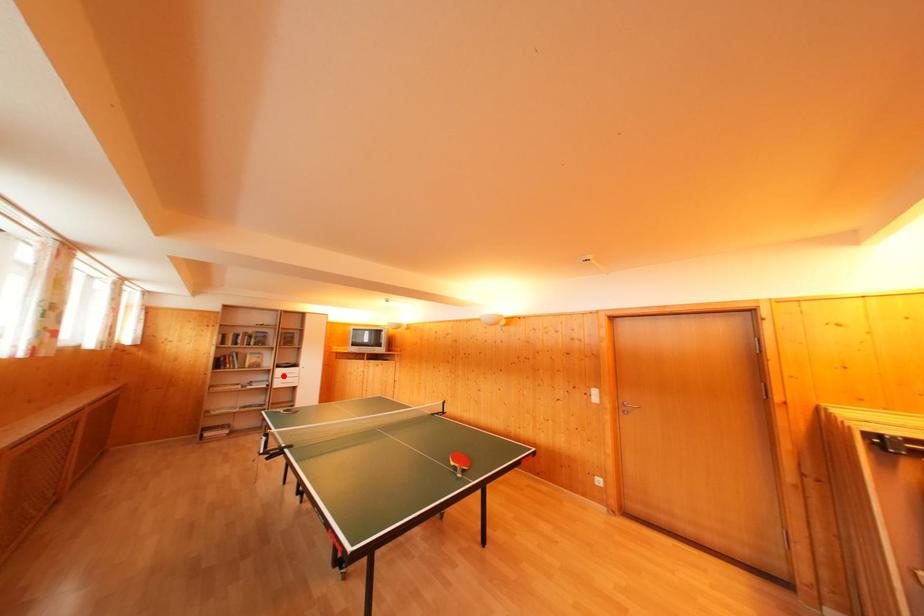
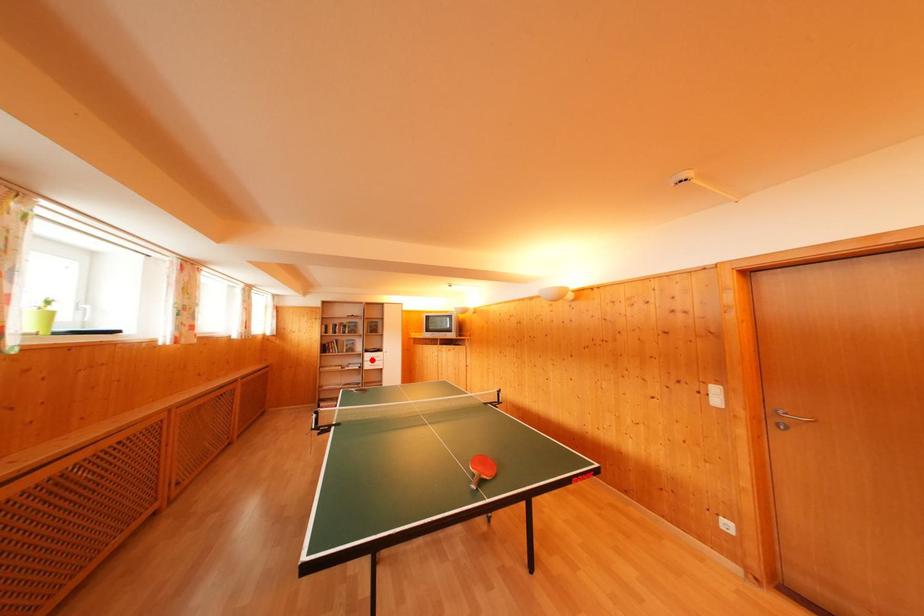
I am providing you with two images of the same scene from different viewpoints. A red point is marked on the first image and another point is marked on the second image. Are the points marked in image1 and image2 representing the same 3D position?

Yes